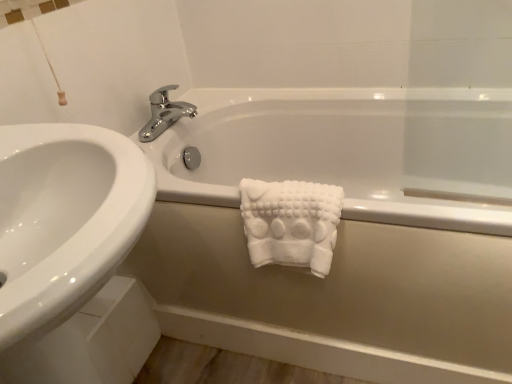
Question: From a real-world perspective, is white matte bathtub at center physically below white fluffy towel at center?

Choices:
 (A) yes
 (B) no

Answer: (A)

Question: Does white matte bathtub at center come behind white fluffy towel at center?

Choices:
 (A) no
 (B) yes

Answer: (A)

Question: Can you confirm if white matte bathtub at center is thinner than white fluffy towel at center?

Choices:
 (A) no
 (B) yes

Answer: (A)

Question: Can you confirm if white matte bathtub at center is positioned to the right of white fluffy towel at center?

Choices:
 (A) no
 (B) yes

Answer: (B)

Question: Is white matte bathtub at center positioned beyond the bounds of white fluffy towel at center?

Choices:
 (A) yes
 (B) no

Answer: (A)

Question: Considering the relative sizes of white matte bathtub at center and white fluffy towel at center in the image provided, is white matte bathtub at center smaller than white fluffy towel at center?

Choices:
 (A) yes
 (B) no

Answer: (B)

Question: Is chrome/metallic faucet at upper center completely or partially inside white matte bathtub at center?

Choices:
 (A) yes
 (B) no

Answer: (B)

Question: Does white matte bathtub at center turn towards chrome/metallic faucet at upper center?

Choices:
 (A) yes
 (B) no

Answer: (B)

Question: Considering the relative sizes of white matte bathtub at center and chrome/metallic faucet at upper center in the image provided, is white matte bathtub at center thinner than chrome/metallic faucet at upper center?

Choices:
 (A) no
 (B) yes

Answer: (A)

Question: Is white matte bathtub at center to the right of chrome/metallic faucet at upper center from the viewer's perspective?

Choices:
 (A) yes
 (B) no

Answer: (A)

Question: Considering the relative positions of white matte bathtub at center and chrome/metallic faucet at upper center in the image provided, is white matte bathtub at center to the left of chrome/metallic faucet at upper center from the viewer's perspective?

Choices:
 (A) yes
 (B) no

Answer: (B)

Question: Is white matte bathtub at center next to chrome/metallic faucet at upper center?

Choices:
 (A) yes
 (B) no

Answer: (B)

Question: Is white fluffy towel at center smaller than white matte bathtub at center?

Choices:
 (A) no
 (B) yes

Answer: (B)